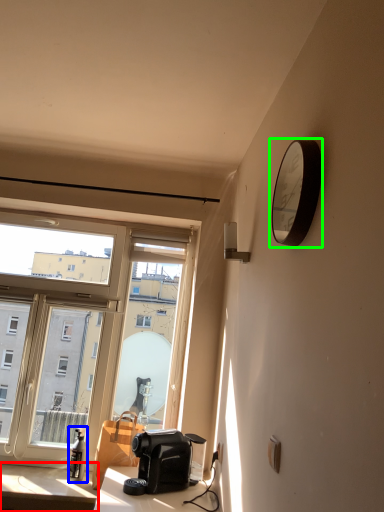
Question: Estimate the real-world distances between objects in this image. Which object is closer to table (highlighted by a red box), bottle (highlighted by a blue box) or clock (highlighted by a green box)?

Choices:
 (A) bottle
 (B) clock

Answer: (A)